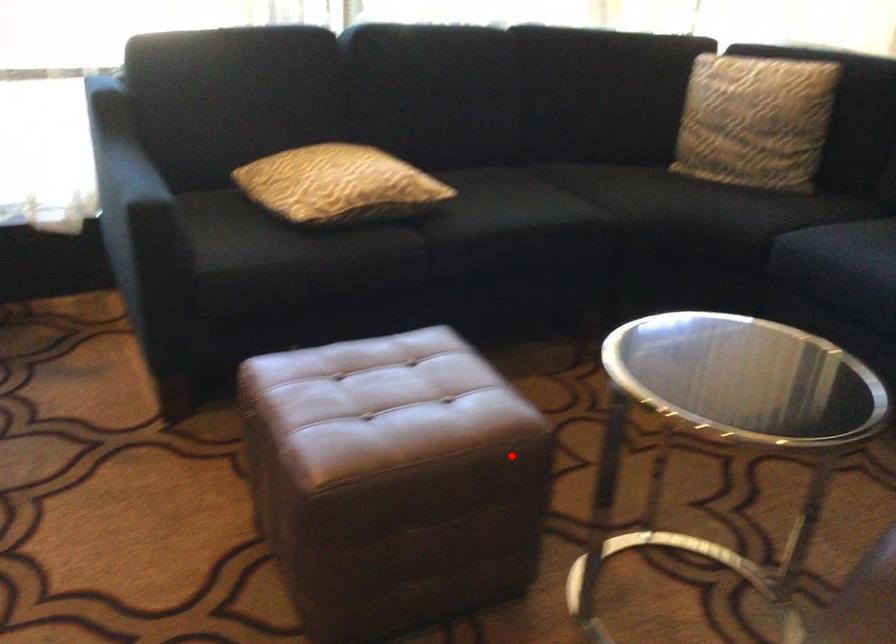
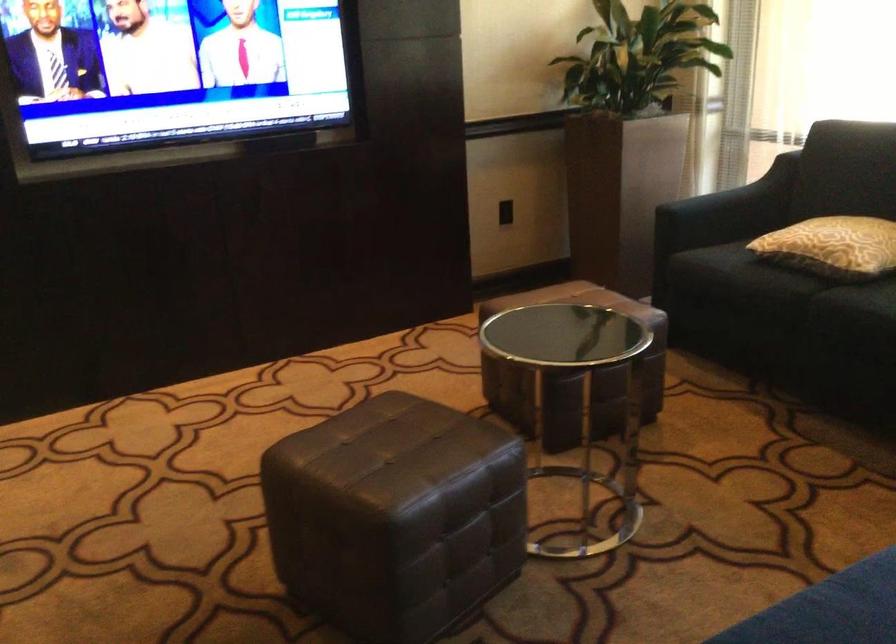
Where in the second image is the point corresponding to the highlighted location from the first image?

(573, 373)